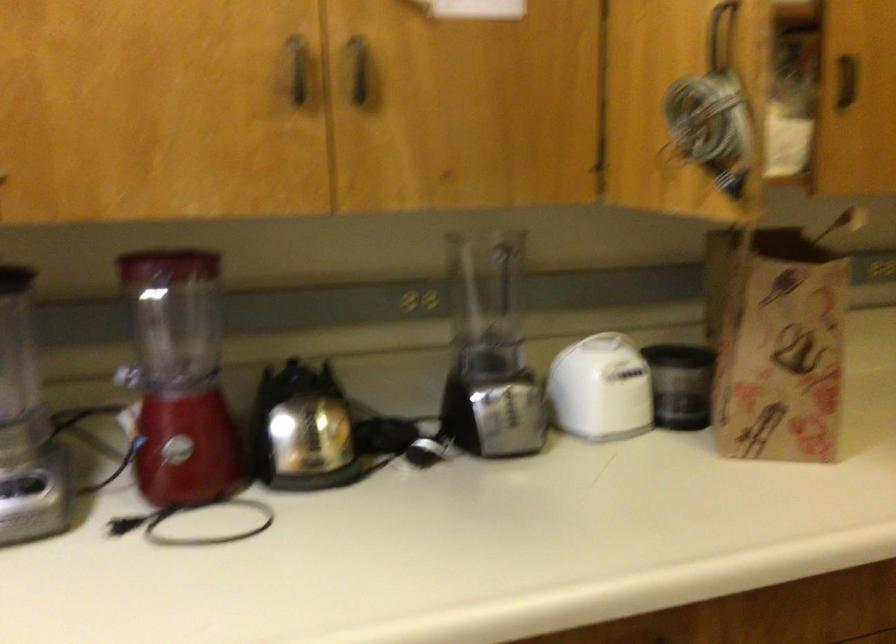
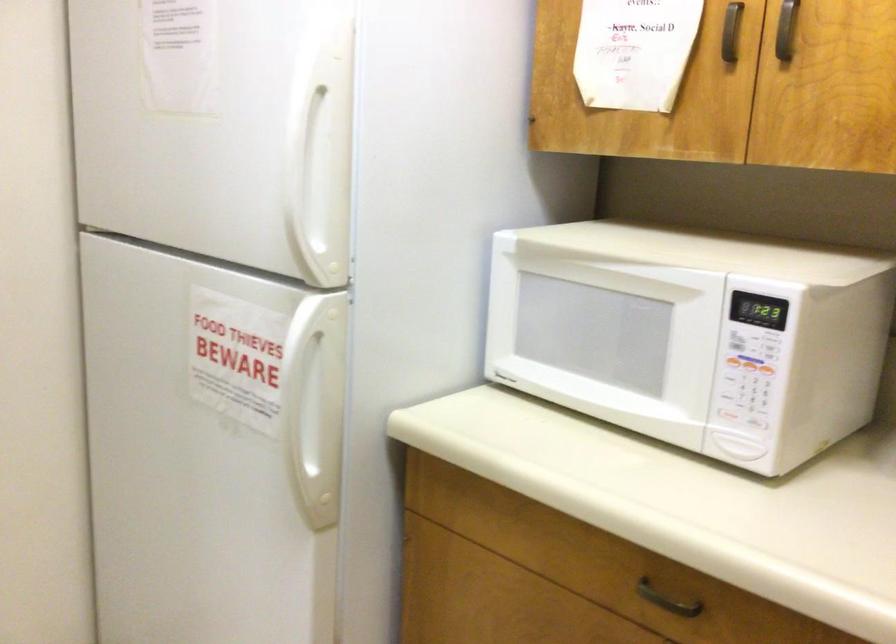
Question: The images are taken continuously from a first-person perspective. In which direction is your viewpoint rotating?

Choices:
 (A) Left
 (B) Right
 (C) Up
 (D) Down

Answer: (A)